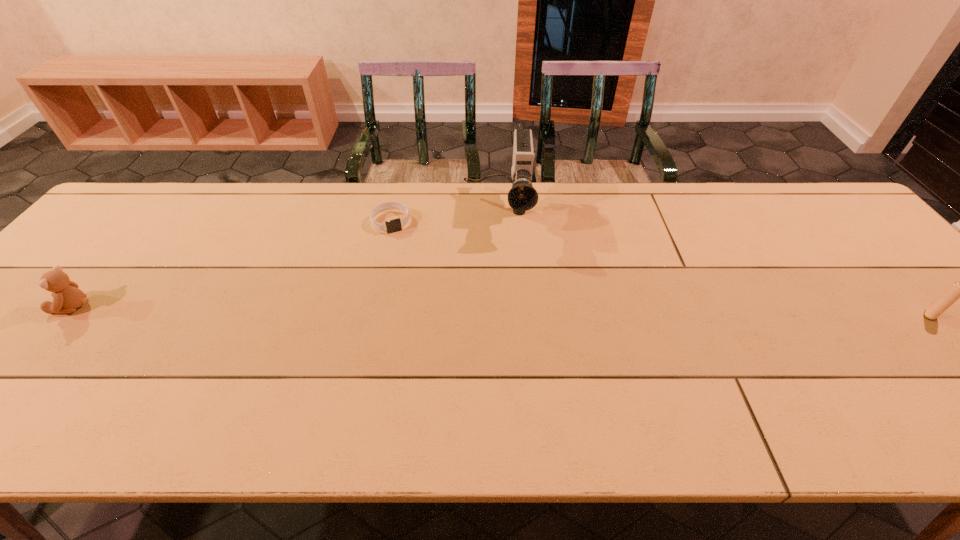
Where is `free point located on the recording direction of the tallest object`? Image resolution: width=960 pixels, height=540 pixels. free point located on the recording direction of the tallest object is located at coordinates (495, 271).

Find the location of a particular element. The image size is (960, 540). free spot located on the outer surface of the second object from left to right is located at coordinates (424, 300).

Identify the location of vacant position located on the outer surface of the second object from left to right. (402, 248).

You are a GUI agent. You are given a task and a screenshot of the screen. Output one action in this format:
    pyautogui.click(x=<x>, y=<y>)
    Task: Click on the vacant space located on the outer surface of the second object from left to right
    
    Given the screenshot: What is the action you would take?
    pyautogui.click(x=406, y=258)

The width and height of the screenshot is (960, 540). Identify the location of camcorder that is at the far edge. (522, 196).

Image resolution: width=960 pixels, height=540 pixels. What are the coordinates of `wristband positioned at the far edge` in the screenshot? It's located at (395, 225).

This screenshot has height=540, width=960. I want to click on object at the left edge, so click(x=67, y=297).

Where is `object at the right edge`? object at the right edge is located at coordinates [957, 290].

Find the location of a particular element. The image size is (960, 540). vacant space at the far edge of the desktop is located at coordinates (328, 199).

Locate an element on the screen. This screenshot has height=540, width=960. vacant space at the near edge of the desktop is located at coordinates (303, 396).